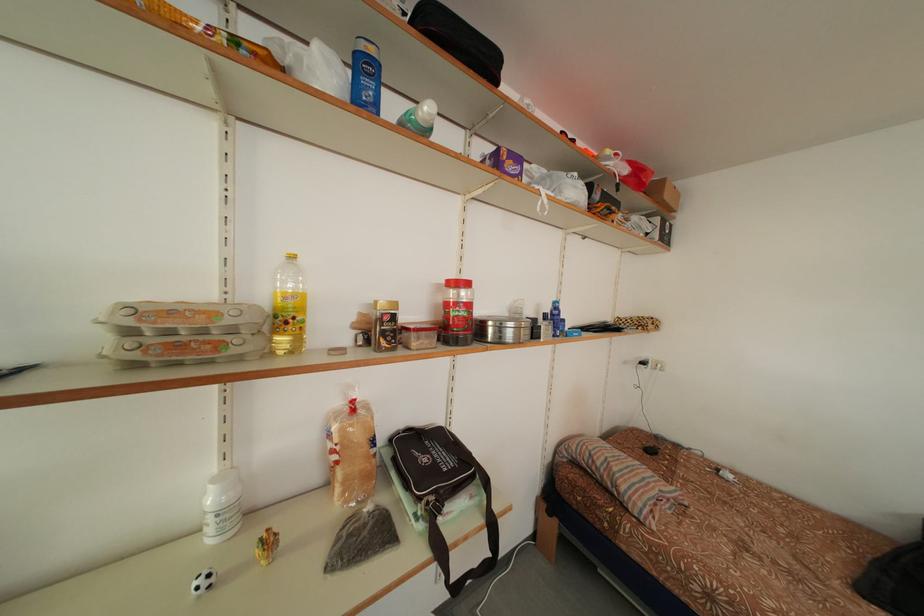
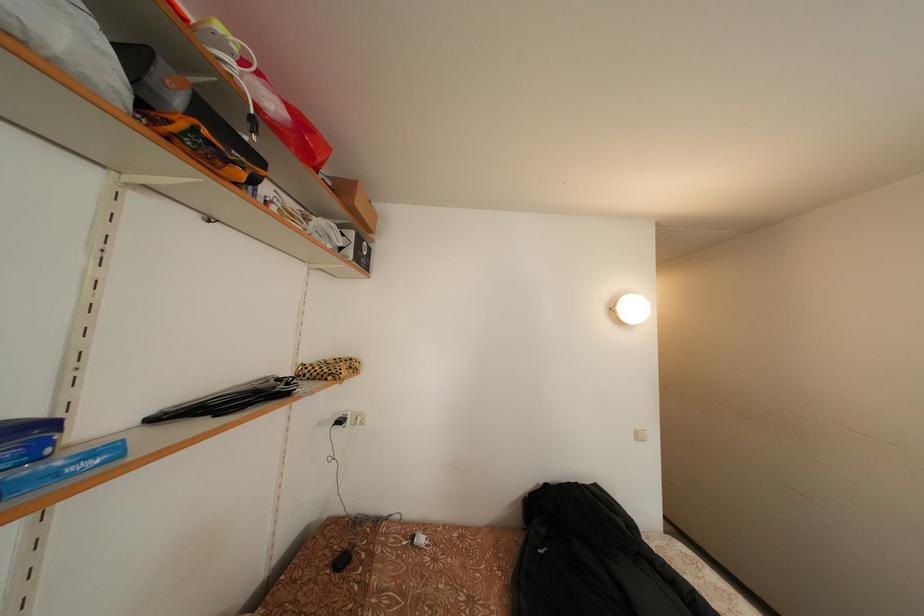
Question: The camera is either moving clockwise (left) or counter-clockwise (right) around the object. The first image is from the beginning of the video and the second image is from the end. Is the camera moving left or right when shooting the video?

Choices:
 (A) Left
 (B) Right

Answer: (A)